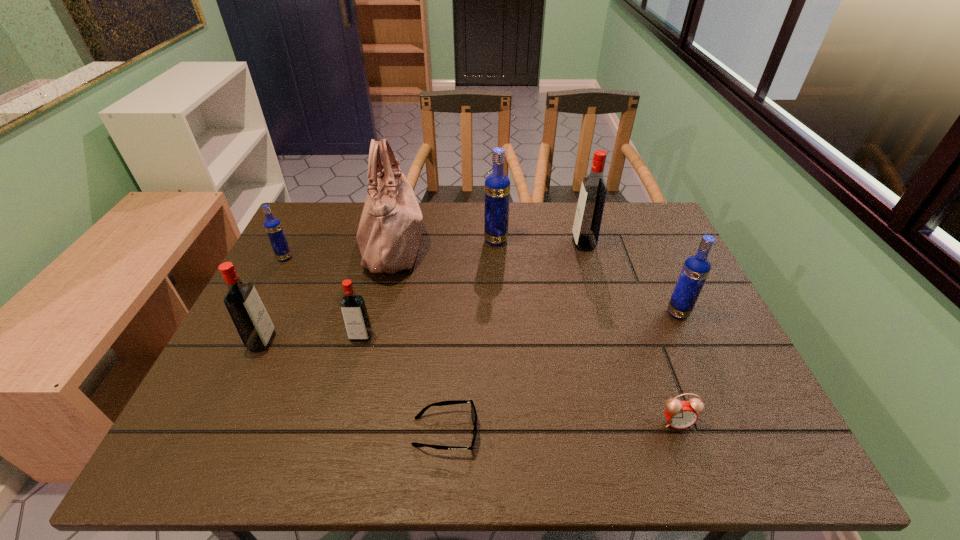
Identify which red vodka is the third nearest to the leftmost object. Please provide its 2D coordinates. Your answer should be formatted as a tuple, i.e. [(x, y)], where the tuple contains the x and y coordinates of a point satisfying the conditions above.

[(588, 217)]

Where is `red vodka that is the second closest to the fifth vodka from right to left`? The image size is (960, 540). red vodka that is the second closest to the fifth vodka from right to left is located at coordinates (588, 217).

You are a GUI agent. You are given a task and a screenshot of the screen. Output one action in this format:
    pyautogui.click(x=<x>, y=<y>)
    Task: Click on the blue vodka that is the closest to the nearest blue vodka
    This screenshot has height=540, width=960.
    Given the screenshot: What is the action you would take?
    pyautogui.click(x=497, y=185)

Choose which blue vodka is the nearest neighbor to the leftmost red vodka. Please provide its 2D coordinates. Your answer should be formatted as a tuple, i.e. [(x, y)], where the tuple contains the x and y coordinates of a point satisfying the conditions above.

[(273, 227)]

Find the location of a particular element. The width and height of the screenshot is (960, 540). vacant area that satisfies the following two spatial constraints: 1. on the front and back of the second red vodka from left to right; 2. on the front and back of the fifth vodka from right to left is located at coordinates (360, 341).

At what (x,y) coordinates should I click in order to perform the action: click on blank area in the image that satisfies the following two spatial constraints: 1. on the front side of the third vodka from right to left; 2. on the left side of the rightmost object. Please return your answer as a coordinate pair (x, y). Looking at the image, I should click on (499, 313).

The height and width of the screenshot is (540, 960). What are the coordinates of `vacant region that satisfies the following two spatial constraints: 1. on the front and back of the smallest red vodka; 2. on the front and back of the second smallest red vodka` in the screenshot? It's located at (360, 341).